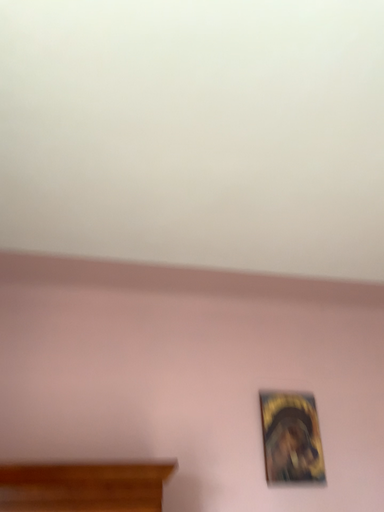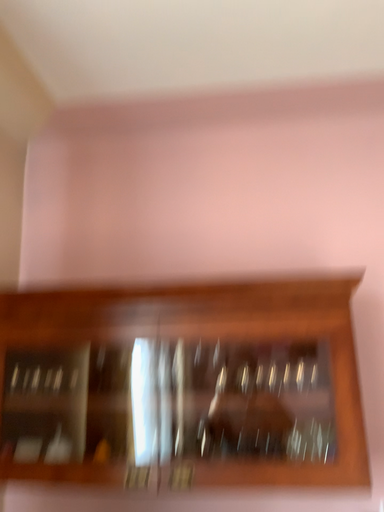
Question: Which way did the camera rotate in the video?

Choices:
 (A) rotated downward
 (B) rotated upward

Answer: (A)